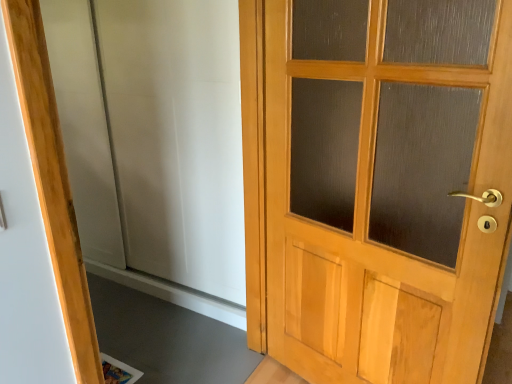
This screenshot has height=384, width=512. In order to click on light wood/glass door at right in this screenshot , I will do `click(376, 185)`.

This screenshot has width=512, height=384. What do you see at coordinates (376, 185) in the screenshot? I see `light wood/glass door at right` at bounding box center [376, 185].

Measure the distance between point (313, 87) and camera.

Point (313, 87) and camera are 7.07 feet apart from each other.

The image size is (512, 384). In order to click on white matte elevator at center in this screenshot , I will do (x=154, y=135).

The height and width of the screenshot is (384, 512). Describe the element at coordinates (154, 135) in the screenshot. I see `white matte elevator at center` at that location.

The width and height of the screenshot is (512, 384). In order to click on light wood/glass door at right in this screenshot , I will do `click(376, 185)`.

Considering the relative positions of white matte elevator at center and light wood/glass door at right in the image provided, is white matte elevator at center to the right of light wood/glass door at right from the viewer's perspective?

No, white matte elevator at center is not to the right of light wood/glass door at right.

Is white matte elevator at center closer to the viewer compared to light wood/glass door at right?

No, it is not.

Is point (126, 98) positioned behind point (418, 80)?

That is True.

From the image's perspective, which is above, white matte elevator at center or light wood/glass door at right?

white matte elevator at center, from the image's perspective.

From a real-world perspective, between white matte elevator at center and light wood/glass door at right, who is vertically lower?

light wood/glass door at right is physically lower.

Can you confirm if white matte elevator at center is thinner than light wood/glass door at right?

Indeed, white matte elevator at center has a lesser width compared to light wood/glass door at right.

Is white matte elevator at center shorter than light wood/glass door at right?

No.

Who is bigger, white matte elevator at center or light wood/glass door at right?

white matte elevator at center is bigger.

Is white matte elevator at center inside the boundaries of light wood/glass door at right, or outside?

white matte elevator at center is located beyond the bounds of light wood/glass door at right.

Is white matte elevator at center in contact with light wood/glass door at right?

No, white matte elevator at center is not next to light wood/glass door at right.

Could you tell me if white matte elevator at center is facing light wood/glass door at right?

No, white matte elevator at center is not turned towards light wood/glass door at right.

What's the angular difference between white matte elevator at center and light wood/glass door at right's facing directions?

13.9 degrees.

Locate an element on the screen. elevator that appears above the light wood/glass door at right (from the image's perspective) is located at coordinates (154, 135).

Would you say light wood/glass door at right is to the left or to the right of white matte elevator at center in the picture?

From the image, it's evident that light wood/glass door at right is to the right of white matte elevator at center.

Which object is more forward, light wood/glass door at right or white matte elevator at center?

light wood/glass door at right.

Between point (270, 336) and point (218, 285), which one is positioned behind?

Point (218, 285)

From the image's perspective, does light wood/glass door at right appear lower than white matte elevator at center?

Correct, light wood/glass door at right appears lower than white matte elevator at center in the image.

From a real-world perspective, is light wood/glass door at right physically located above or below white matte elevator at center?

From a real-world perspective, light wood/glass door at right is physically below white matte elevator at center.

Does light wood/glass door at right have a greater width compared to white matte elevator at center?

Yes, light wood/glass door at right is wider than white matte elevator at center.

In terms of height, does light wood/glass door at right look taller or shorter compared to white matte elevator at center?

light wood/glass door at right is shorter than white matte elevator at center.

In terms of size, does light wood/glass door at right appear bigger or smaller than white matte elevator at center?

light wood/glass door at right is smaller than white matte elevator at center.

Consider the image. Is light wood/glass door at right completely or partially outside of white matte elevator at center?

light wood/glass door at right lies outside white matte elevator at center's area.

Can you see light wood/glass door at right touching white matte elevator at center?

There is a gap between light wood/glass door at right and white matte elevator at center.

Is light wood/glass door at right facing away from white matte elevator at center?

light wood/glass door at right does not have its back to white matte elevator at center.

I want to click on elevator that appears above the light wood/glass door at right (from a real-world perspective), so click(154, 135).

This screenshot has height=384, width=512. Find the location of `elevator on the left of light wood/glass door at right`. elevator on the left of light wood/glass door at right is located at coordinates (154, 135).

This screenshot has height=384, width=512. Find the location of `elevator above the light wood/glass door at right (from a real-world perspective)`. elevator above the light wood/glass door at right (from a real-world perspective) is located at coordinates (154, 135).